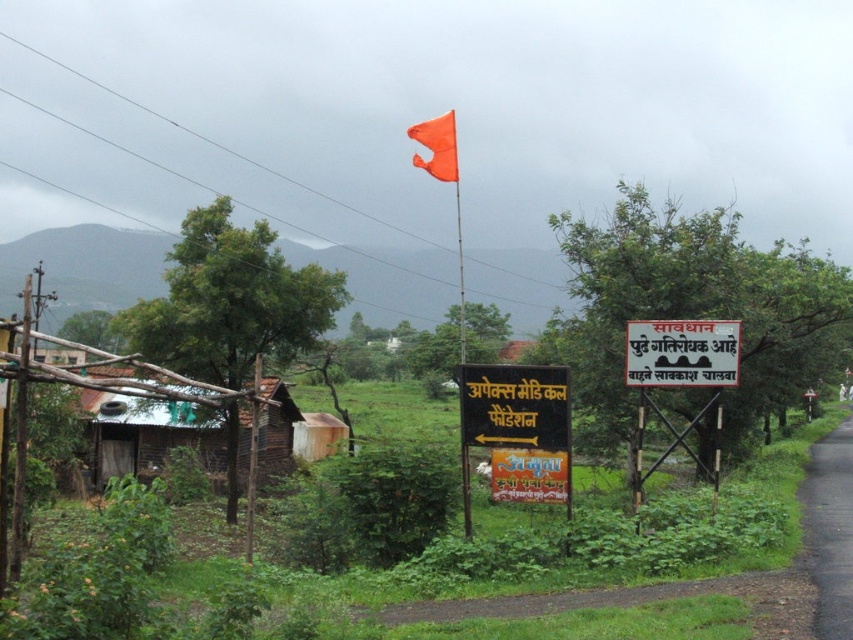
Question: Considering the relative positions of black matte signboard at center and orange fabric flag at center in the image provided, where is black matte signboard at center located with respect to orange fabric flag at center?

Choices:
 (A) right
 (B) left

Answer: (A)

Question: Based on their relative distances, which object is farther from the orange fabric flag at upper center?

Choices:
 (A) black matte signboard at center
 (B) orange fabric flag at center

Answer: (A)

Question: Does white plastic sign at center appear over orange fabric flag at center?

Choices:
 (A) yes
 (B) no

Answer: (B)

Question: Is white plastic signboard at center smaller than orange fabric flag at upper center?

Choices:
 (A) no
 (B) yes

Answer: (B)

Question: Which is nearer to the black matte signboard at center?

Choices:
 (A) white plastic sign at center
 (B) orange fabric flag at upper center
 (C) orange fabric flag at center
 (D) white plastic signboard at center

Answer: (A)

Question: Which point appears farthest from the camera in this image?

Choices:
 (A) (440, 138)
 (B) (465, 353)

Answer: (B)